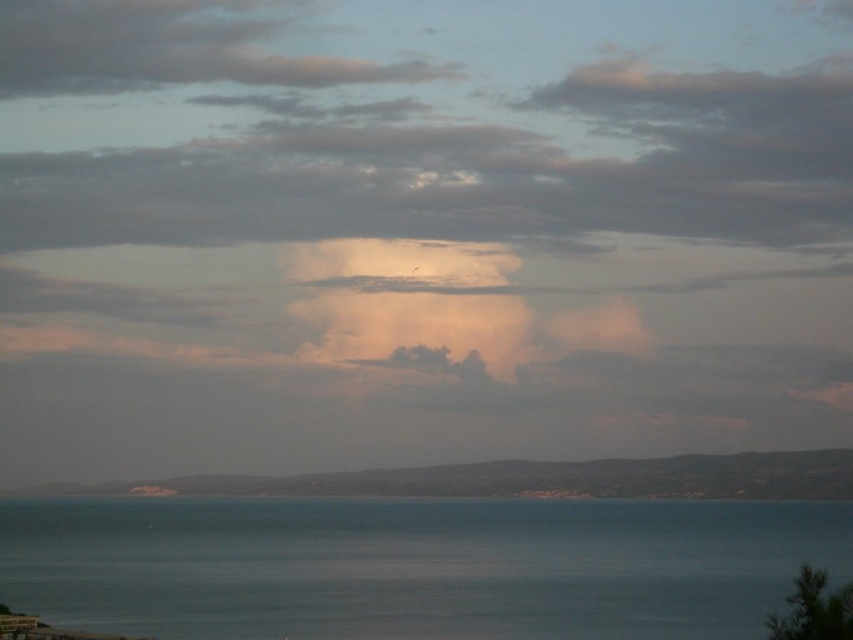
Does point (643, 584) lie in front of point (537, 486)?

Yes, point (643, 584) is in front of point (537, 486).

Can you confirm if blue water at center is shorter than smooth sand at lower center?

No, blue water at center is not shorter than smooth sand at lower center.

Which is behind, point (492, 522) or point (653, 493)?

The point (653, 493) is more distant.

You are a GUI agent. You are given a task and a screenshot of the screen. Output one action in this format:
    pyautogui.click(x=<x>, y=<y>)
    Task: Click on the blue water at center
    The width and height of the screenshot is (853, 640).
    Given the screenshot: What is the action you would take?
    pyautogui.click(x=415, y=566)